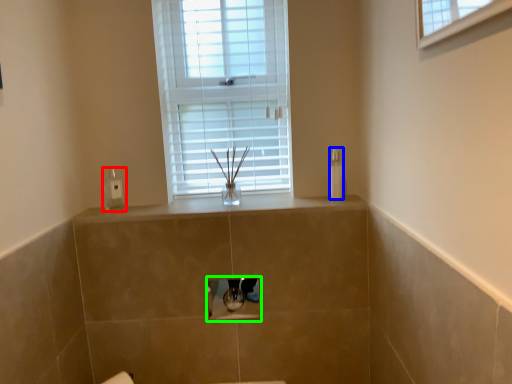
Question: Based on their relative distances, which object is nearer to soap dispenser (highlighted by a red box)? Choose from toiletry (highlighted by a blue box) and medicine cabinet (highlighted by a green box).

Choices:
 (A) toiletry
 (B) medicine cabinet

Answer: (B)